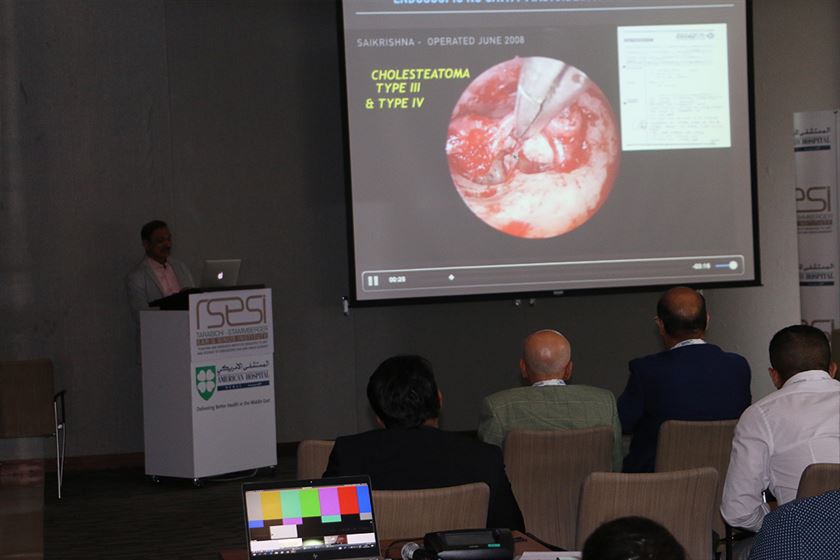
At what (x,y) coordinates should I click in order to perform the action: click on laptop. Please return your answer as a coordinate pair (x, y). The image size is (840, 560). Looking at the image, I should click on (218, 270).